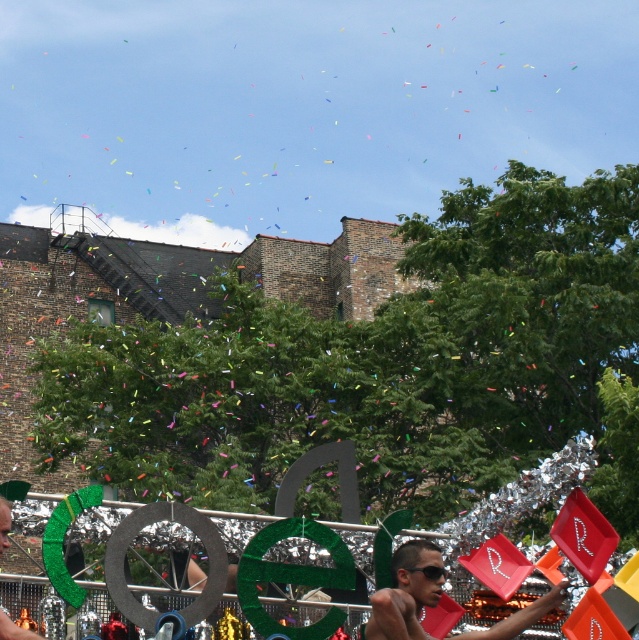
Question: Among these objects, which one is nearest to the camera?

Choices:
 (A) black plastic goggles at center
 (B) shiny black sunglasses at center
 (C) shiny metallic sunglasses at center

Answer: (C)

Question: Is shiny black sunglasses at center to the right of shiny metallic sunglasses at center from the viewer's perspective?

Choices:
 (A) yes
 (B) no

Answer: (A)

Question: Among these points, which one is nearest to the camera?

Choices:
 (A) (426, 573)
 (B) (8, 637)

Answer: (B)

Question: Is shiny black sunglasses at center wider than black plastic goggles at center?

Choices:
 (A) yes
 (B) no

Answer: (B)

Question: Among these objects, which one is nearest to the camera?

Choices:
 (A) black plastic goggles at center
 (B) shiny black sunglasses at center

Answer: (B)

Question: Observing the image, what is the correct spatial positioning of shiny black sunglasses at center in reference to shiny metallic sunglasses at center?

Choices:
 (A) above
 (B) below

Answer: (B)